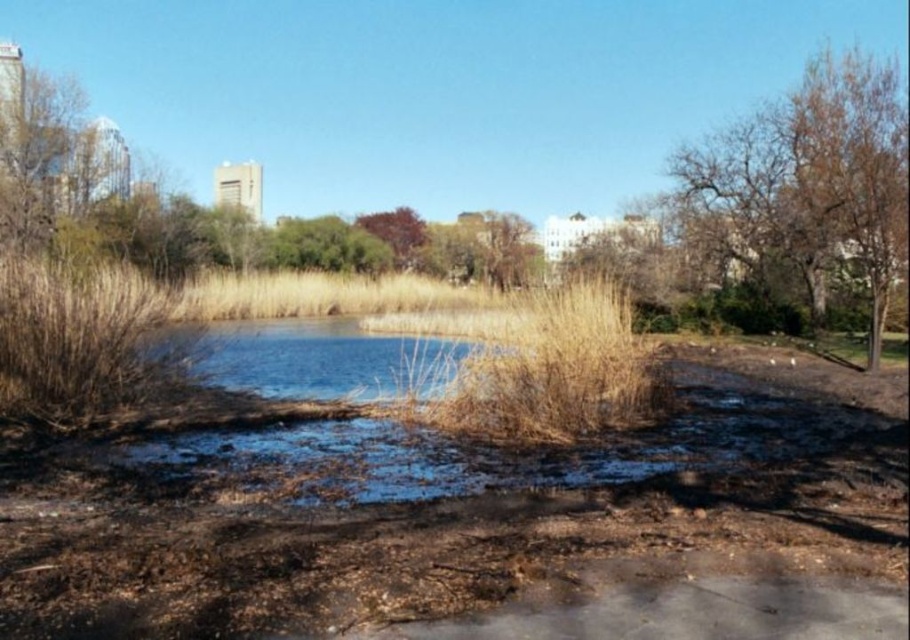
You are a photographer planning to capture the entire scene of the blue water at center and the purple leafy tree at center in one shot. Given that your camera has a fixed focal length, which object should you focus on first to ensure both are in frame?

Since the blue water at center is larger in size than the purple leafy tree at center, you should focus on the blue water at center first to ensure both fit within the frame.

You are a park visitor who wants to cross the pond. You see the dry grass at center and the blue water at center. Which one is larger and can support your weight?

The blue water at center is larger than the dry grass at center, but water cannot support your weight. You should avoid stepping on both as the dry grass is smaller and the water might be too shallow or unsafe.

You are standing in the park and want to take a photo of both the point at coordinates (587,426) and the point at coordinates (375,339). Which point will appear larger in your camera view?

The point at coordinates (587,426) will appear larger in the camera view because it is closer to the camera than the point at coordinates (375,339).